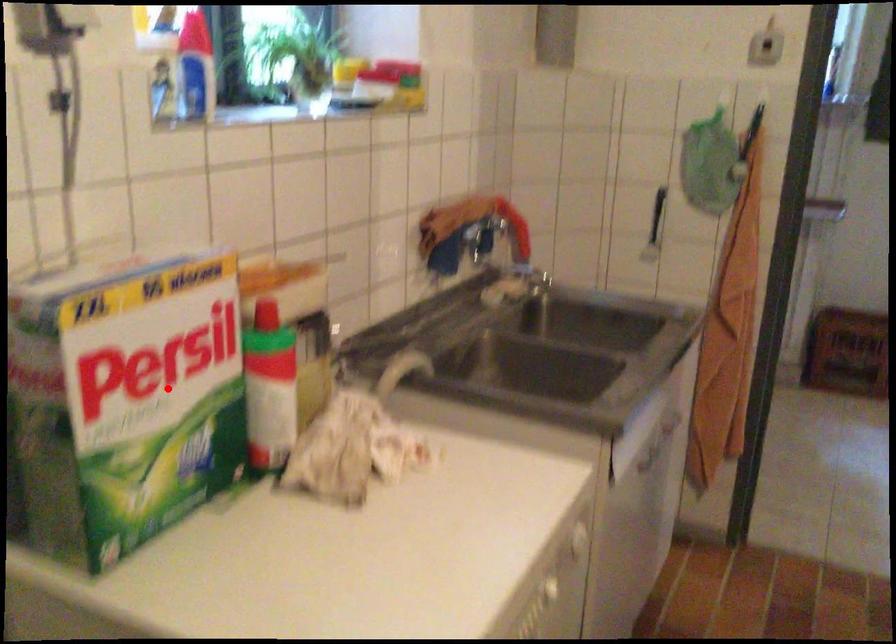
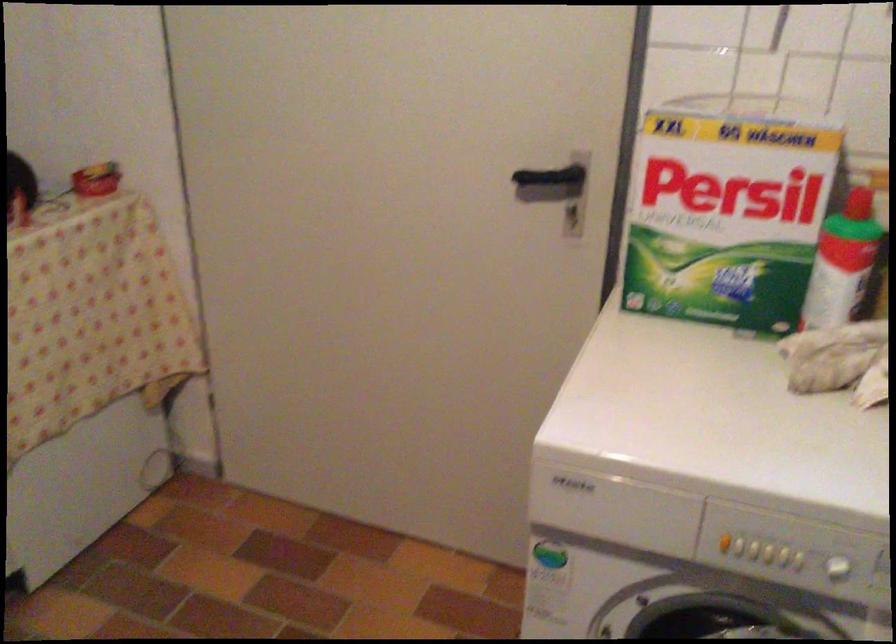
Question: I am providing you with two images of the same scene from different viewpoints. Image1 has a red point marked. In image2, the corresponding 3D location appears at what relative position? Reply with the corresponding letter.

Choices:
 (A) Closer
 (B) Farther

Answer: (B)